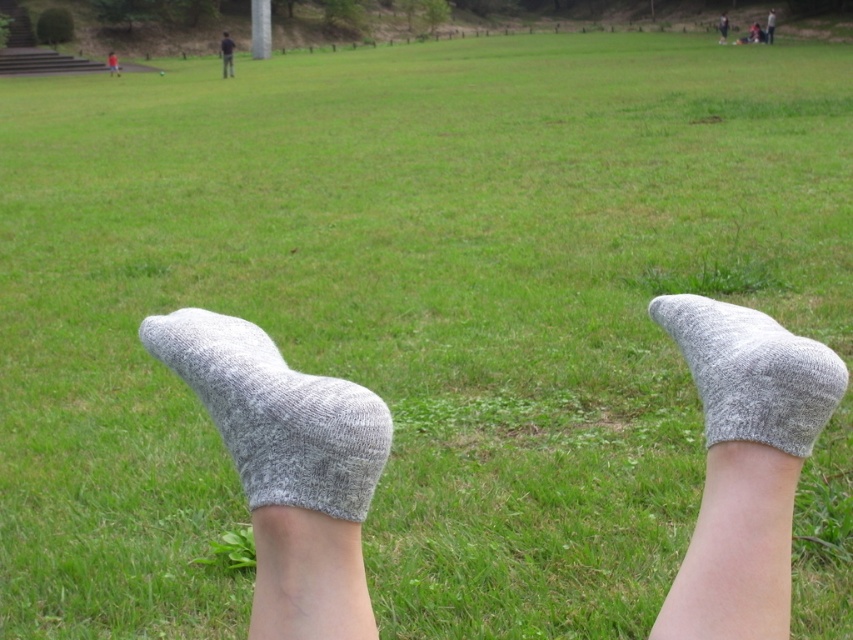
You are standing in a grassy field and notice two pairs of gray knitted socks at your feet. One is labeled as the gray knitted sock at lower center and the other as the gray knitted socks at lower center. Which one is closer to you?

The gray knitted sock at lower center is closer to you because it is positioned in front of the gray knitted socks at lower center.